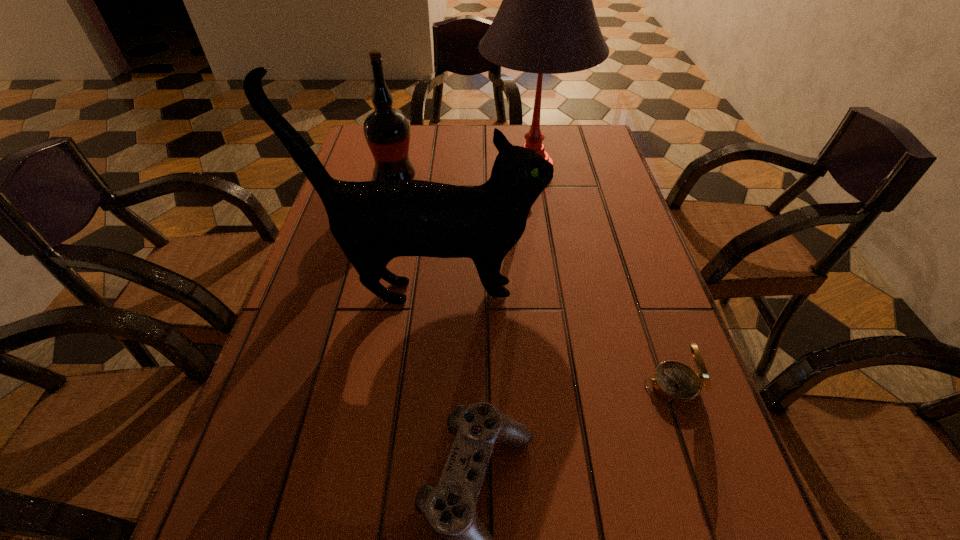
The height and width of the screenshot is (540, 960). Identify the location of blank space located 0.240m with the dial facing the second shortest object. (510, 386).

This screenshot has width=960, height=540. What are the coordinates of `free space located 0.130m with the dial facing the second shortest object` in the screenshot? It's located at (571, 386).

Locate an element on the screen. vacant space located with the dial facing the second shortest object is located at coordinates (459, 386).

This screenshot has width=960, height=540. Find the location of `object present at the far edge`. object present at the far edge is located at coordinates (546, 24).

This screenshot has height=540, width=960. What are the coordinates of `cat positioned at the left edge` in the screenshot? It's located at (373, 222).

Locate an element on the screen. This screenshot has height=540, width=960. wine bottle present at the left edge is located at coordinates (387, 131).

Image resolution: width=960 pixels, height=540 pixels. What are the coordinates of `table lamp that is at the right edge` in the screenshot? It's located at (546, 24).

At what (x,y) coordinates should I click in order to perform the action: click on compass that is at the right edge. Please return your answer as a coordinate pair (x, y). The image size is (960, 540). Looking at the image, I should click on (677, 383).

Where is `object that is positioned at the far right corner`? The width and height of the screenshot is (960, 540). object that is positioned at the far right corner is located at coordinates (546, 24).

In order to click on vacant area at the left edge of the desktop in this screenshot , I will do `click(315, 378)`.